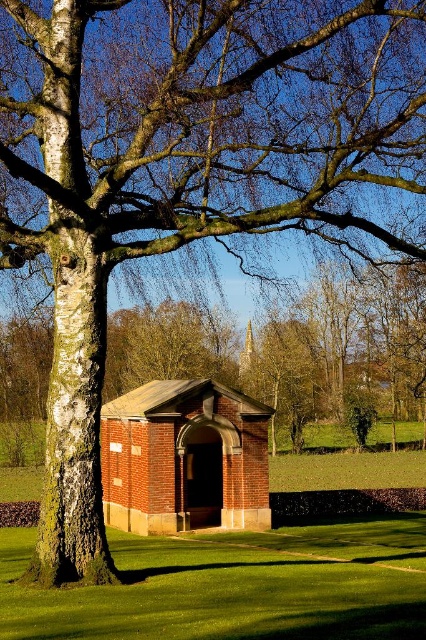
Between green grass at lower center and brick/tile hut at center, which one has more height?

With more height is brick/tile hut at center.

Between green grass at lower center and brick/tile hut at center, which one is positioned lower?

green grass at lower center

The image size is (426, 640). I want to click on green grass at lower center, so 233,586.